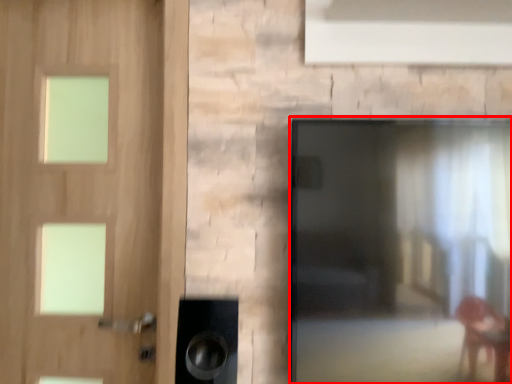
Question: From the image's perspective, where is screen door (annotated by the red box) located relative to door?

Choices:
 (A) above
 (B) below

Answer: (B)